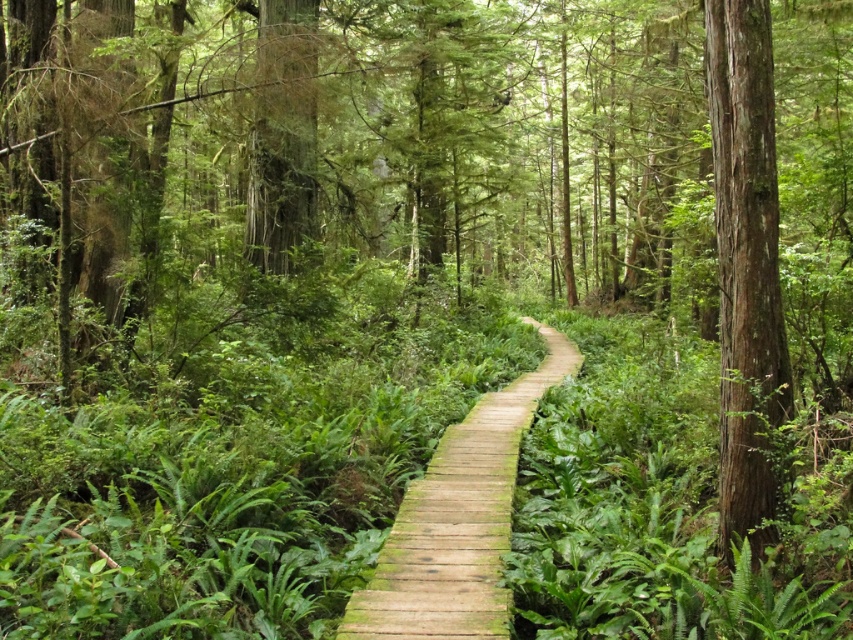
Measure the distance from smooth brown tree trunk at right to wooden planks at center.

smooth brown tree trunk at right and wooden planks at center are 10.13 feet apart.

Does smooth brown tree trunk at right have a larger size compared to wooden planks at center?

Actually, smooth brown tree trunk at right might be smaller than wooden planks at center.

Is point (727, 120) less distant than point (492, 468)?

That is True.

The width and height of the screenshot is (853, 640). Find the location of `smooth brown tree trunk at right`. smooth brown tree trunk at right is located at coordinates (746, 262).